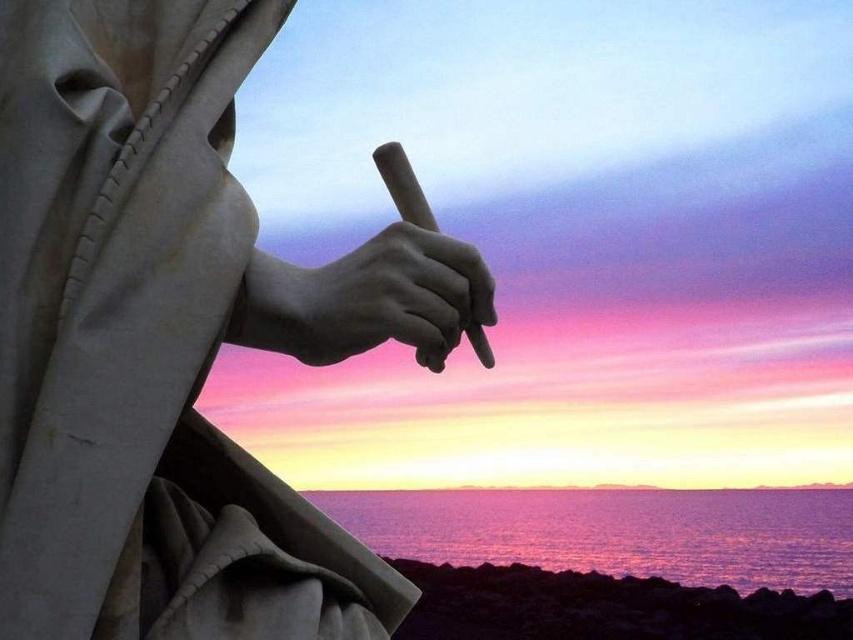
You are a photographer trying to capture the statue hand and the water in the same frame. Based on their positions, will the matte stone hand at center be visible in front of the purple reflective water at lower center?

The matte stone hand at center is behind the purple reflective water at lower center, so it will not be visible in front of it.

Consider the image. You are an artist trying to sketch the scene. You need to decide which object to draw first based on their widths. According to the scene, which object should you start with, the white marble hand at center or the purple reflective water at lower center?

The white marble hand at center has a greater width than the purple reflective water at lower center, so you should start drawing the white marble hand at center first.